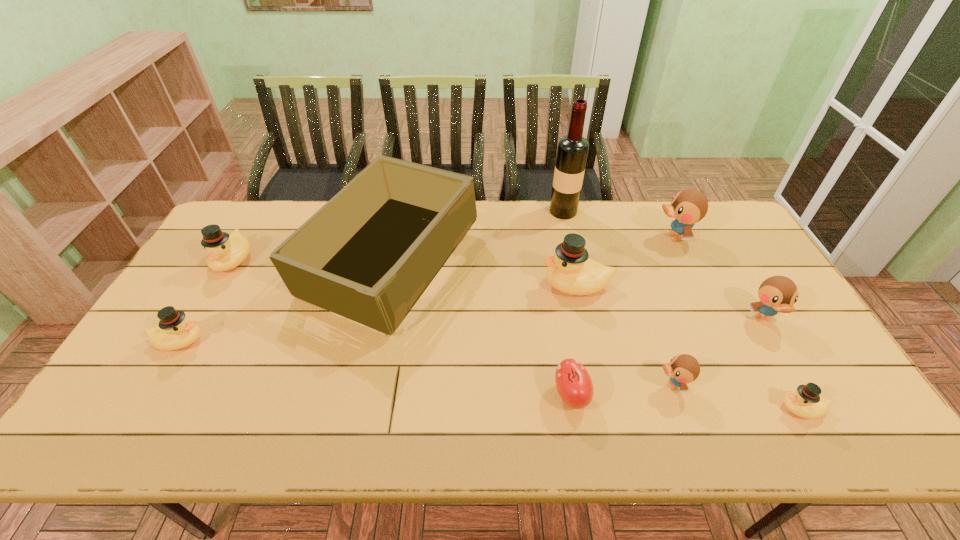
The width and height of the screenshot is (960, 540). I want to click on free space between the box and the second smallest yellow duck, so click(x=284, y=302).

Identify the location of free space between the smallest blue duck and the biggest yellow duck. This screenshot has width=960, height=540. (625, 335).

At what (x,y) coordinates should I click in order to perform the action: click on free space between the eighth object from right to left and the smallest blue duck. Please return your answer as a coordinate pair (x, y). Looking at the image, I should click on (531, 325).

This screenshot has width=960, height=540. I want to click on empty location between the second blue duck from right to left and the second smallest blue duck, so click(718, 278).

You are a GUI agent. You are given a task and a screenshot of the screen. Output one action in this format:
    pyautogui.click(x=<x>, y=<y>)
    Task: Click on the vacant area between the fourth duck from left to right and the third smallest yellow duck
    
    Given the screenshot: What is the action you would take?
    pyautogui.click(x=452, y=322)

Where is `object identified as the seventh closest to the biggest yellow duck`? object identified as the seventh closest to the biggest yellow duck is located at coordinates (805, 402).

Locate which object ranks fourth in proximity to the third duck from left to right. Please provide its 2D coordinates. Your answer should be formatted as a tuple, i.e. [(x, y)], where the tuple contains the x and y coordinates of a point satisfying the conditions above.

[(573, 382)]

Select which duck is the closest to the fourth duck from left to right. Please provide its 2D coordinates. Your answer should be formatted as a tuple, i.e. [(x, y)], where the tuple contains the x and y coordinates of a point satisfying the conditions above.

[(805, 402)]

Where is `the closest duck relative to the smallest yellow duck`? the closest duck relative to the smallest yellow duck is located at coordinates (777, 294).

Identify which blue duck is located as the third nearest to the rightmost yellow duck. Please provide its 2D coordinates. Your answer should be formatted as a tuple, i.e. [(x, y)], where the tuple contains the x and y coordinates of a point satisfying the conditions above.

[(689, 206)]